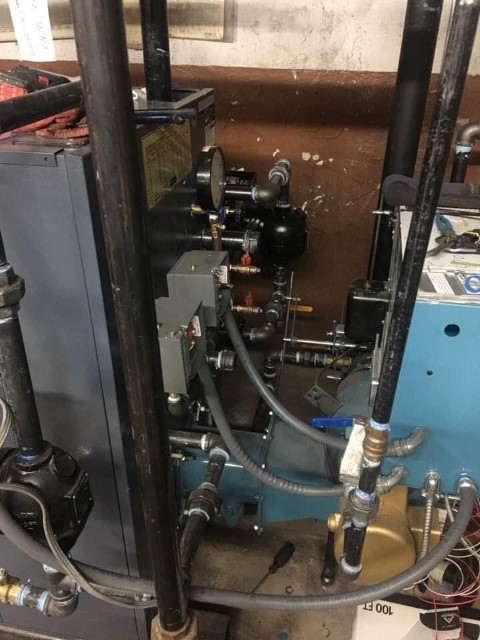
Find the location of `cords`. cords is located at coordinates (441, 550), (263, 481), (269, 397).